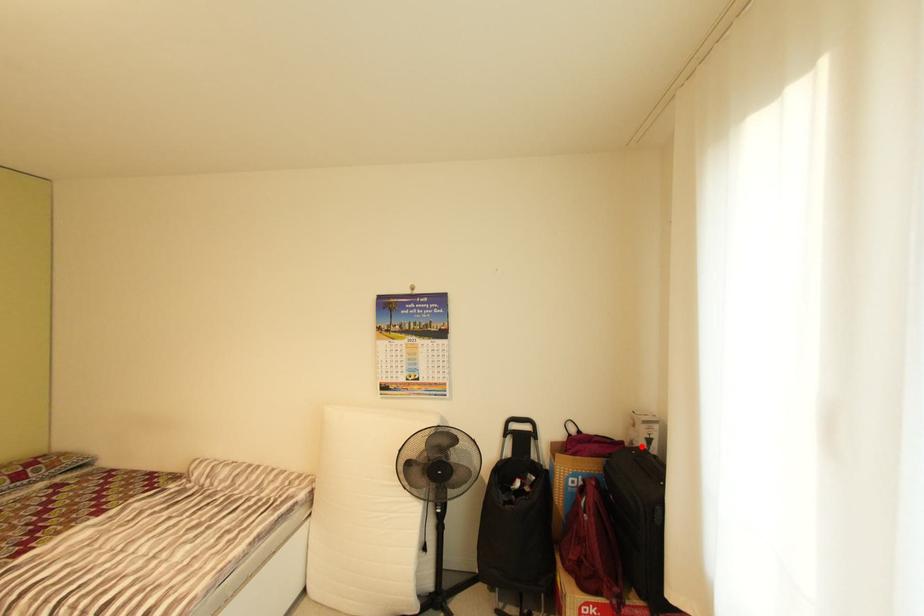
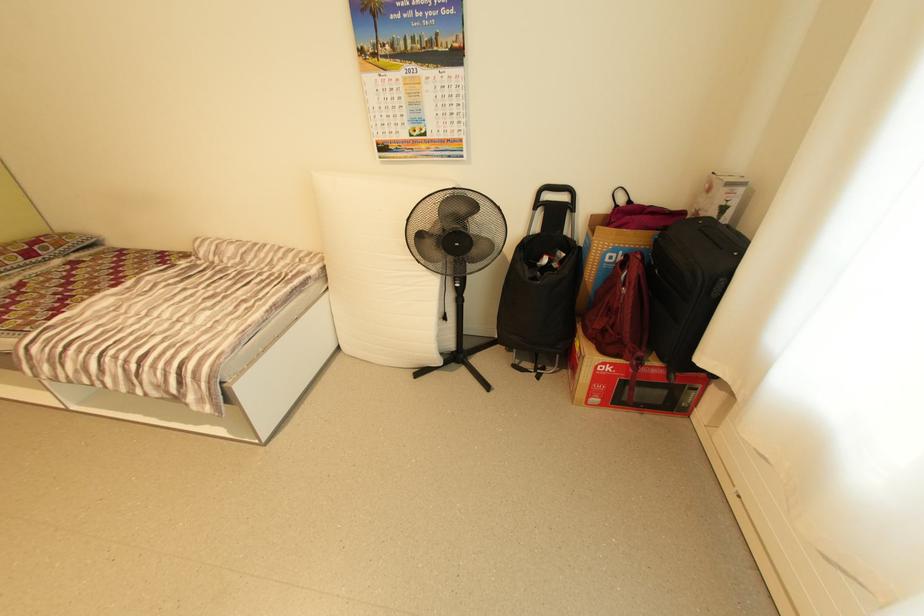
Where in the second image is the point corresponding to the highlighted location from the first image?

(709, 217)